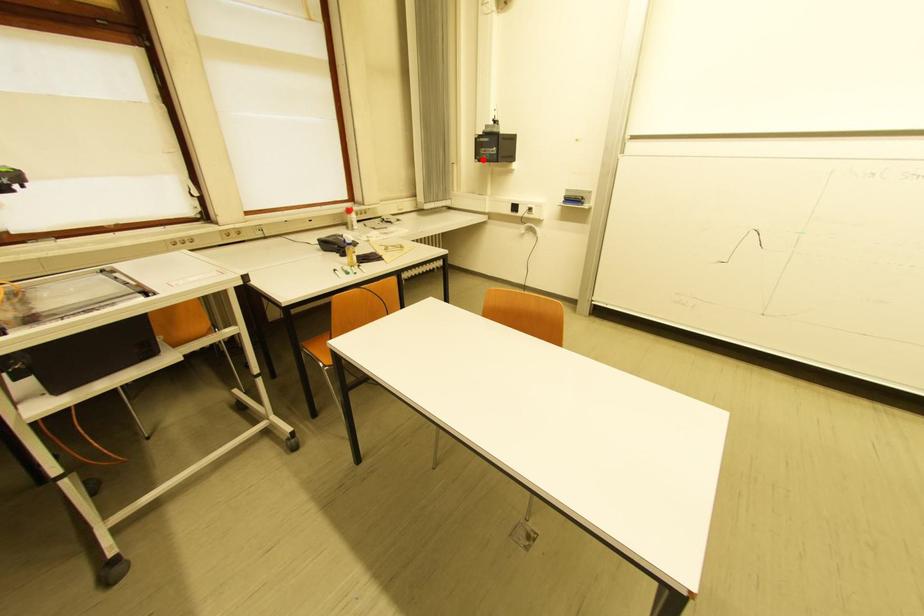
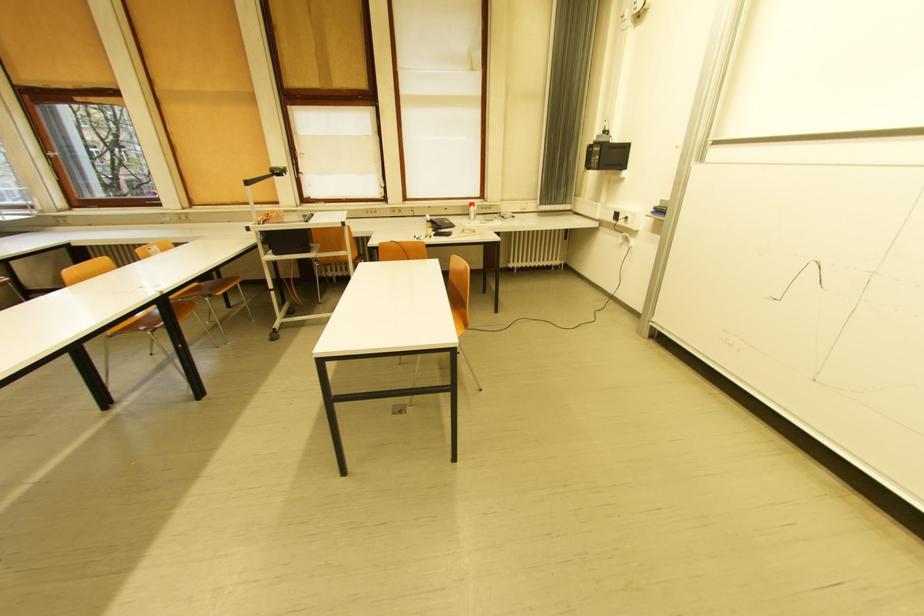
Where in the second image is the point corresponding to the highlighted location from the first image?

(592, 168)